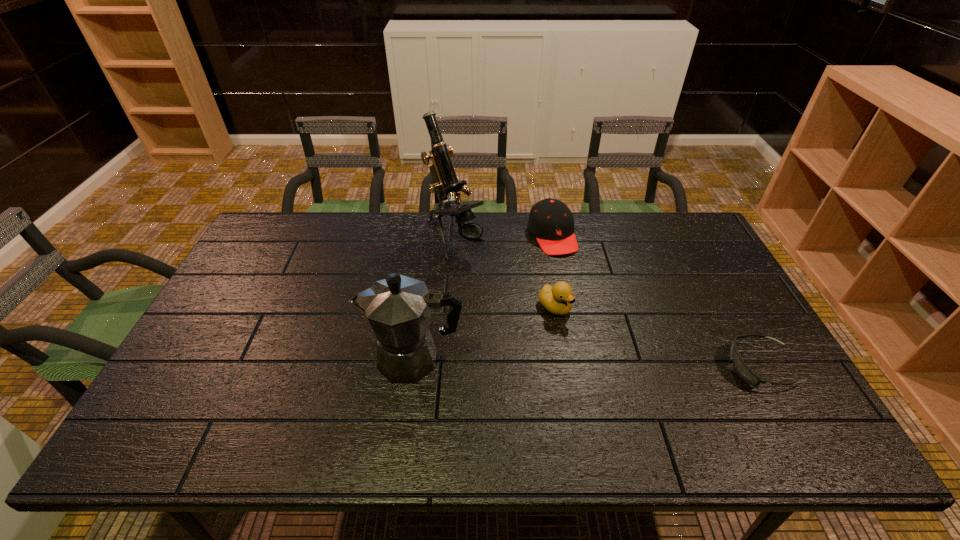
At what (x,y) coordinates should I click in order to perform the action: click on vacant point at the right edge. Please return your answer as a coordinate pair (x, y). Looking at the image, I should click on (710, 274).

Where is `vacant position at the far right corner of the desktop`? The height and width of the screenshot is (540, 960). vacant position at the far right corner of the desktop is located at coordinates (694, 245).

In the image, there is a desktop. Identify the location of vacant space at the near right corner. This screenshot has width=960, height=540. (757, 407).

Where is `vacant point located between the duckling and the fourth shortest object`? vacant point located between the duckling and the fourth shortest object is located at coordinates (484, 333).

At what (x,y) coordinates should I click in order to perform the action: click on empty space between the rightmost object and the cap. Please return your answer as a coordinate pair (x, y). Looking at the image, I should click on (657, 301).

Identify the location of empty location between the cap and the shortest object. The image size is (960, 540). (657, 301).

You are a GUI agent. You are given a task and a screenshot of the screen. Output one action in this format:
    pyautogui.click(x=<x>, y=<y>)
    Task: Click on the free space between the cap and the coffeepot
    This screenshot has height=540, width=960.
    Given the screenshot: What is the action you would take?
    pyautogui.click(x=483, y=298)

At what (x,y) coordinates should I click in order to perform the action: click on free point between the shortest object and the tallest object. Please return your answer as a coordinate pair (x, y). This screenshot has height=540, width=960. Looking at the image, I should click on (608, 303).

Where is `free space that is in between the cap and the second tallest object`? This screenshot has width=960, height=540. free space that is in between the cap and the second tallest object is located at coordinates (483, 298).

You are a GUI agent. You are given a task and a screenshot of the screen. Output one action in this format:
    pyautogui.click(x=<x>, y=<y>)
    Task: Click on the blank region between the shortest object and the fourth shortest object
    
    Given the screenshot: What is the action you would take?
    pyautogui.click(x=588, y=363)